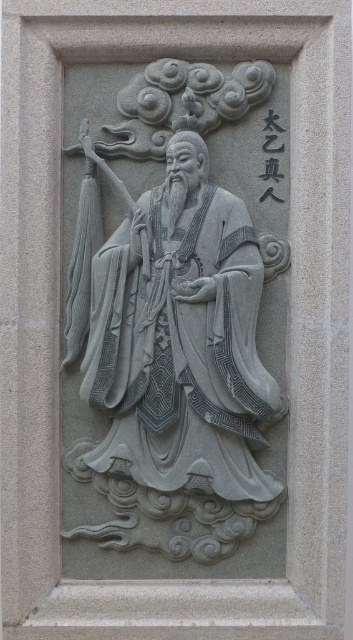
Is point (230, 218) closer to camera compared to point (271, 163)?

That is True.

Does gray stone figure at center have a greater width compared to black stone text at upper right?

Indeed, gray stone figure at center has a greater width compared to black stone text at upper right.

Is point (164, 285) farther from viewer compared to point (271, 136)?

No, (164, 285) is in front of (271, 136).

Image resolution: width=353 pixels, height=640 pixels. Find the location of `gray stone figure at center`. gray stone figure at center is located at coordinates (174, 324).